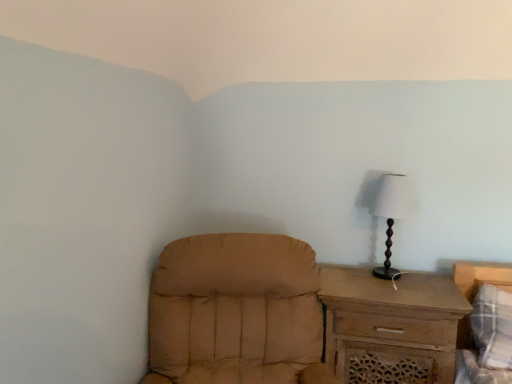
Where is `free space on the front side of white fabric lampshade at right`? The height and width of the screenshot is (384, 512). free space on the front side of white fabric lampshade at right is located at coordinates (400, 293).